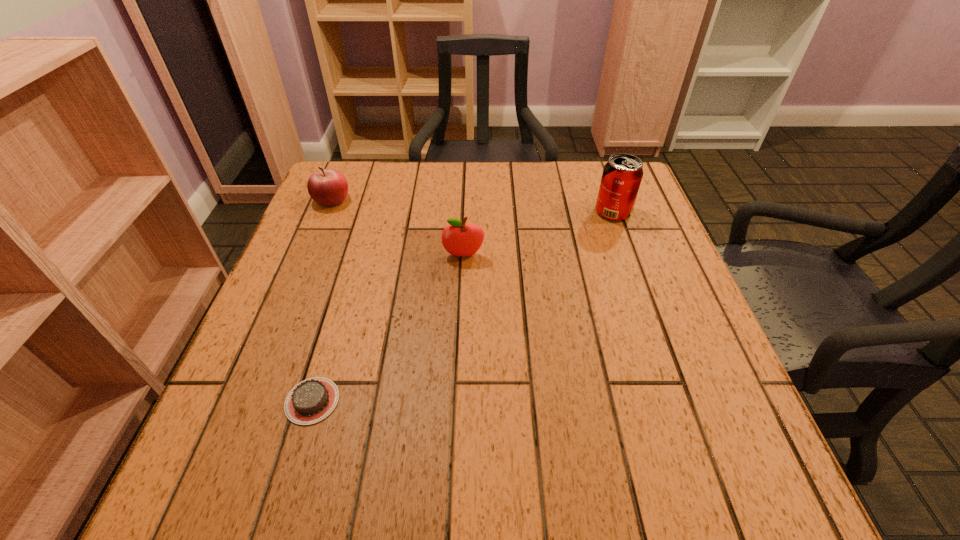
At what (x,y) coordinates should I click in order to perform the action: click on the rightmost object. Please return your answer as a coordinate pair (x, y). The image size is (960, 540). Looking at the image, I should click on (622, 174).

Image resolution: width=960 pixels, height=540 pixels. Find the location of `the tallest object`. the tallest object is located at coordinates (622, 174).

Identify the location of the third object from left to right. The height and width of the screenshot is (540, 960). (459, 239).

Identify the location of the right apple. (459, 239).

Locate an element on the screen. The height and width of the screenshot is (540, 960). the shorter apple is located at coordinates (328, 187).

This screenshot has width=960, height=540. What are the coordinates of `the left apple` in the screenshot? It's located at (328, 187).

I want to click on the shortest object, so click(310, 401).

The width and height of the screenshot is (960, 540). Identify the location of the nearest object. (310, 401).

At what (x,y) coordinates should I click in order to perform the action: click on free region located 0.120m on the front of the rightmost object. Please return your answer as a coordinate pair (x, y). This screenshot has height=540, width=960. Looking at the image, I should click on (629, 256).

This screenshot has height=540, width=960. Identify the location of vacant space located 0.250m on the right of the third object from left to right. click(595, 255).